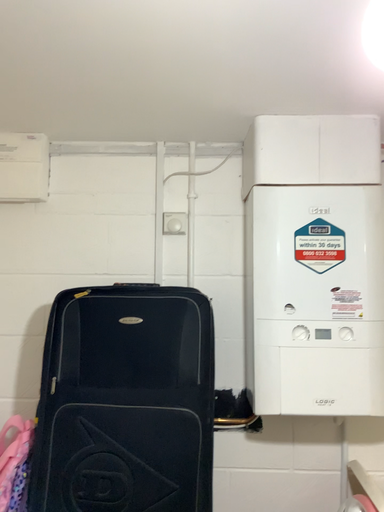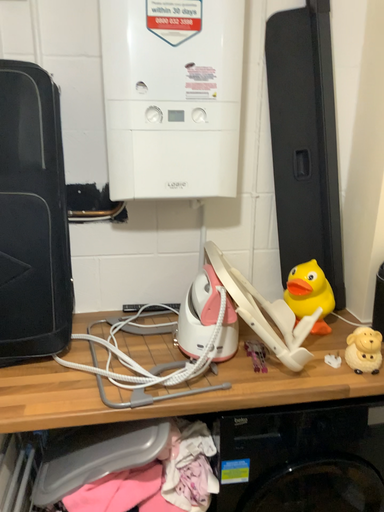
Question: Which way did the camera rotate in the video?

Choices:
 (A) rotated upward
 (B) rotated downward

Answer: (B)